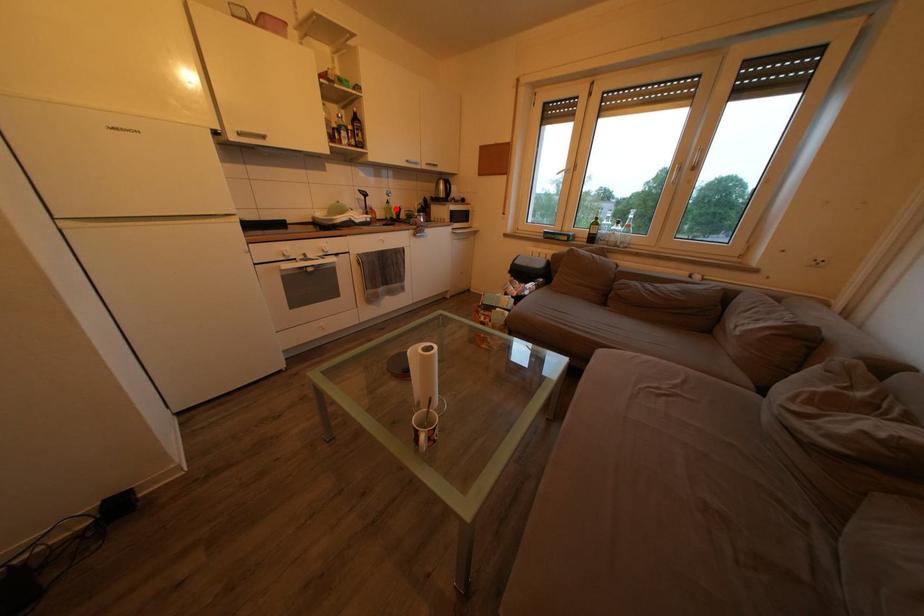
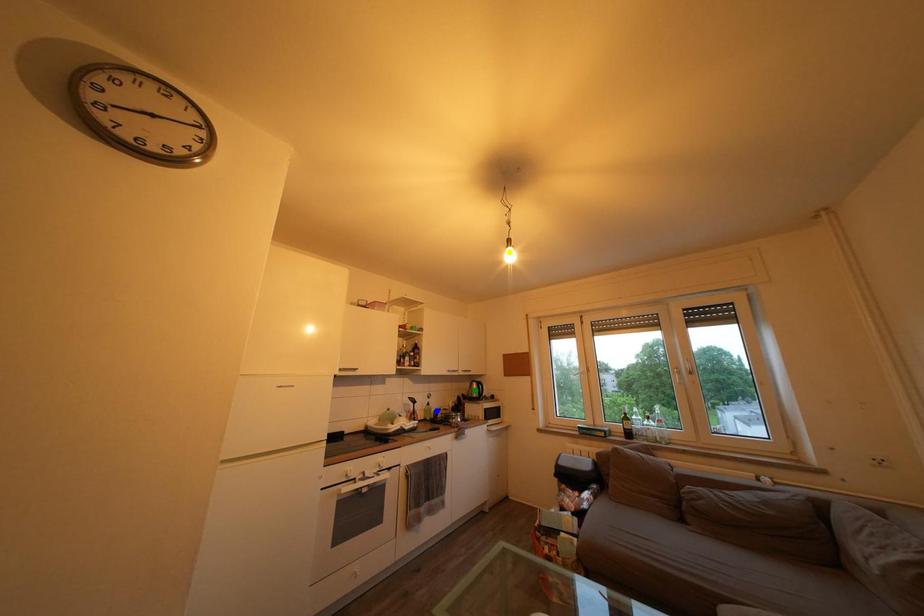
Question: I am providing you with two images of the same scene from different viewpoints. A red point is marked on the first image. You are given multiple points on the second image. In image 2, which mark is for the same physical point as the one in image 1?

Choices:
 (A) green point
 (B) yellow point
 (C) blue point

Answer: (C)